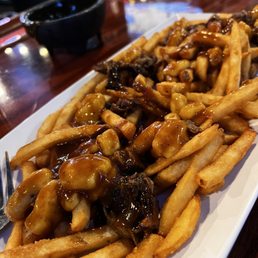
In order to click on bowl in this screenshot , I will do `click(73, 19)`.